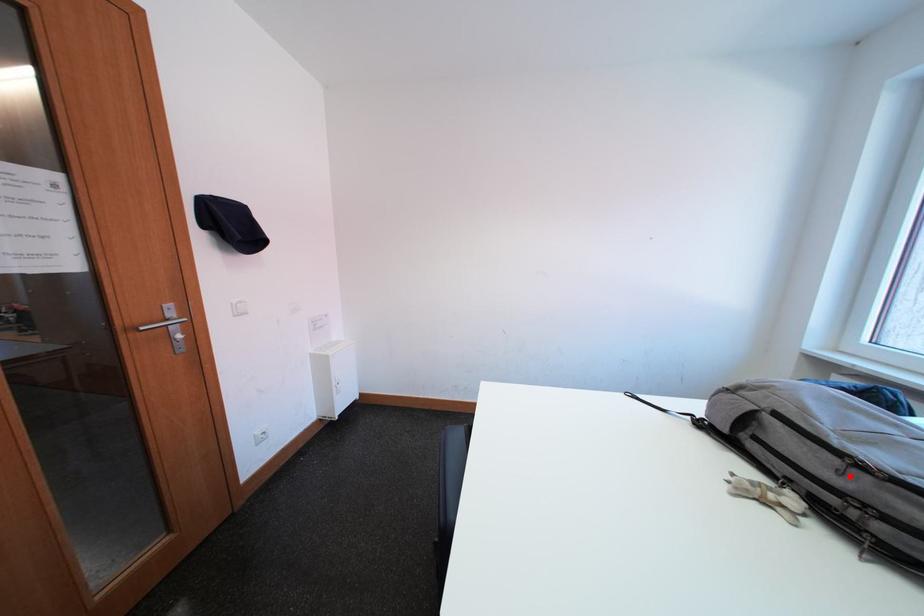
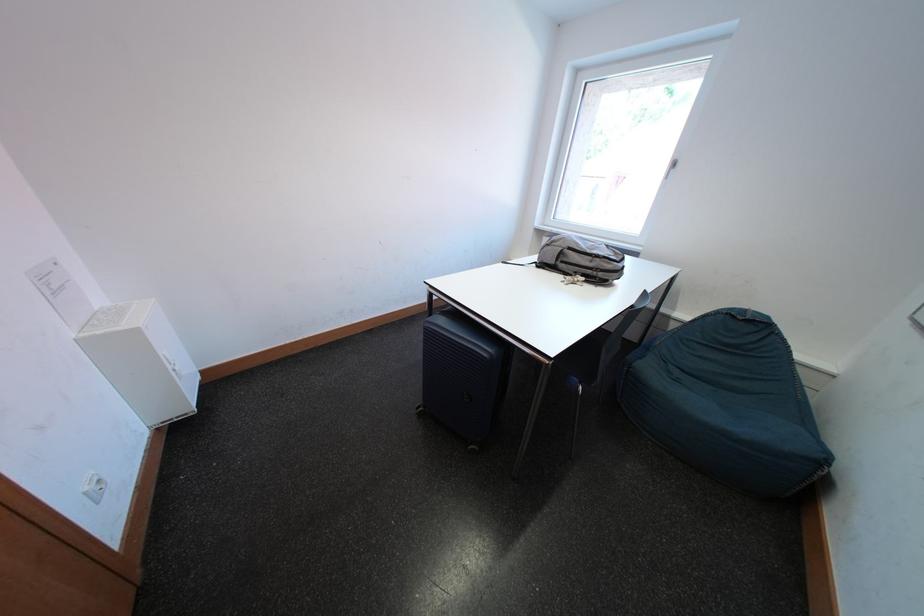
The point at the highlighted location is marked in the first image. Where is the corresponding point in the second image?

(601, 265)